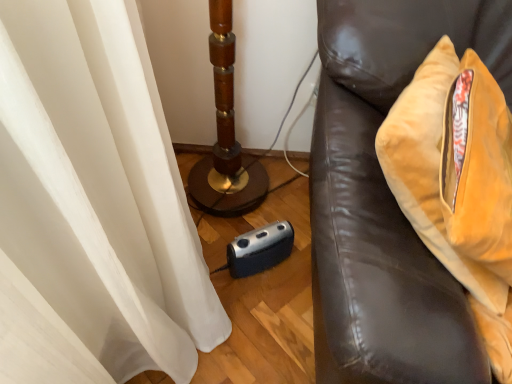
What do you see at coordinates (386, 197) in the screenshot?
I see `brown leather couch at right` at bounding box center [386, 197].

Where is `brown leather couch at right`? The height and width of the screenshot is (384, 512). brown leather couch at right is located at coordinates (386, 197).

Find the location of `brown leather couch at right`. brown leather couch at right is located at coordinates (386, 197).